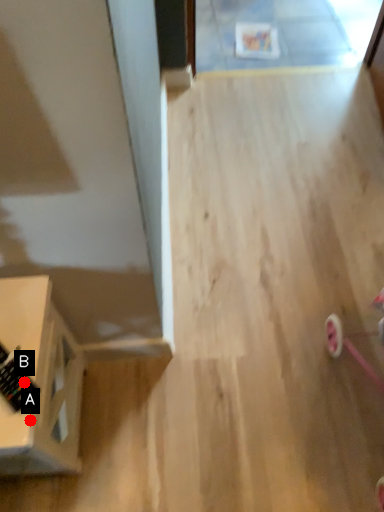
Question: Two points are circled on the image, labeled by A and B beside each circle. Which of the following is the closest to the observer?

Choices:
 (A) A is closer
 (B) B is closer

Answer: (A)